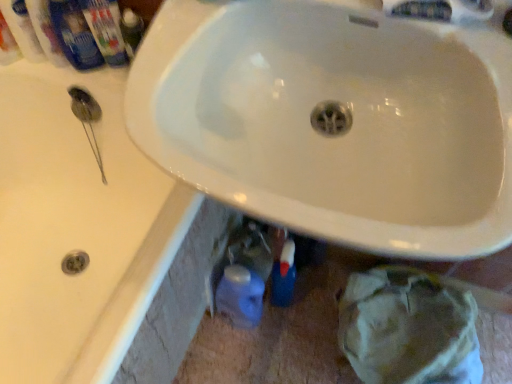
Question: Is white plastic mouthwash at upper left, acting as the 4th mouthwash starting from the right, outside of matte plastic toothpaste tube at upper left?

Choices:
 (A) yes
 (B) no

Answer: (A)

Question: Considering the relative positions of white plastic mouthwash at upper left, the 1th mouthwash when ordered from left to right, and matte plastic toothpaste tube at upper left in the image provided, is white plastic mouthwash at upper left, the 1th mouthwash when ordered from left to right, to the right of matte plastic toothpaste tube at upper left from the viewer's perspective?

Choices:
 (A) yes
 (B) no

Answer: (B)

Question: From a real-world perspective, is white plastic mouthwash at upper left, the 1th mouthwash when ordered from left to right, located beneath matte plastic toothpaste tube at upper left?

Choices:
 (A) no
 (B) yes

Answer: (A)

Question: Can you confirm if white plastic mouthwash at upper left, the 1th mouthwash when ordered from left to right, is smaller than matte plastic toothpaste tube at upper left?

Choices:
 (A) yes
 (B) no

Answer: (A)

Question: Is matte plastic toothpaste tube at upper left inside white plastic mouthwash at upper left, the 1th mouthwash when ordered from left to right?

Choices:
 (A) no
 (B) yes

Answer: (A)

Question: Does white plastic mouthwash at upper left, acting as the 4th mouthwash starting from the right, have a larger size compared to matte plastic toothpaste tube at upper left?

Choices:
 (A) no
 (B) yes

Answer: (A)

Question: Considering the relative positions of matte plastic toothpaste tube at upper left and blue plastic mouthwash at upper left, which is counted as the first mouthwash, starting from the right, in the image provided, is matte plastic toothpaste tube at upper left in front of blue plastic mouthwash at upper left, which is counted as the first mouthwash, starting from the right,?

Choices:
 (A) yes
 (B) no

Answer: (B)

Question: Considering the relative positions of matte plastic toothpaste tube at upper left and blue plastic mouthwash at upper left, which is counted as the first mouthwash, starting from the right, in the image provided, is matte plastic toothpaste tube at upper left behind blue plastic mouthwash at upper left, which is counted as the first mouthwash, starting from the right,?

Choices:
 (A) no
 (B) yes

Answer: (B)

Question: Is matte plastic toothpaste tube at upper left aimed at blue plastic mouthwash at upper left, which appears as the 4th mouthwash when viewed from the left?

Choices:
 (A) no
 (B) yes

Answer: (A)

Question: Can you confirm if matte plastic toothpaste tube at upper left is shorter than blue plastic mouthwash at upper left, which is counted as the first mouthwash, starting from the right?

Choices:
 (A) yes
 (B) no

Answer: (A)

Question: Considering the relative sizes of matte plastic toothpaste tube at upper left and blue plastic mouthwash at upper left, which appears as the 4th mouthwash when viewed from the left, in the image provided, is matte plastic toothpaste tube at upper left taller than blue plastic mouthwash at upper left, which appears as the 4th mouthwash when viewed from the left,?

Choices:
 (A) no
 (B) yes

Answer: (A)

Question: Does matte plastic toothpaste tube at upper left have a lesser width compared to blue plastic mouthwash at upper left, which is counted as the first mouthwash, starting from the right?

Choices:
 (A) yes
 (B) no

Answer: (B)

Question: Is blue plastic mouthwash at upper left, the 3th mouthwash from the left, surrounding white plastic mouthwash at upper left, the 1th mouthwash when ordered from left to right?

Choices:
 (A) no
 (B) yes

Answer: (A)